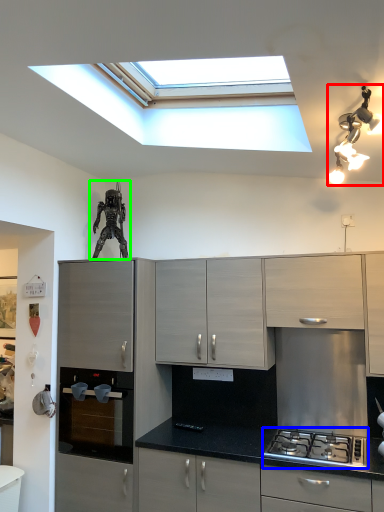
Question: Considering the real-world distances, which object is closest to light fixture (highlighted by a red box)? gas stove (highlighted by a blue box) or sculpture (highlighted by a green box).

Choices:
 (A) gas stove
 (B) sculpture

Answer: (A)